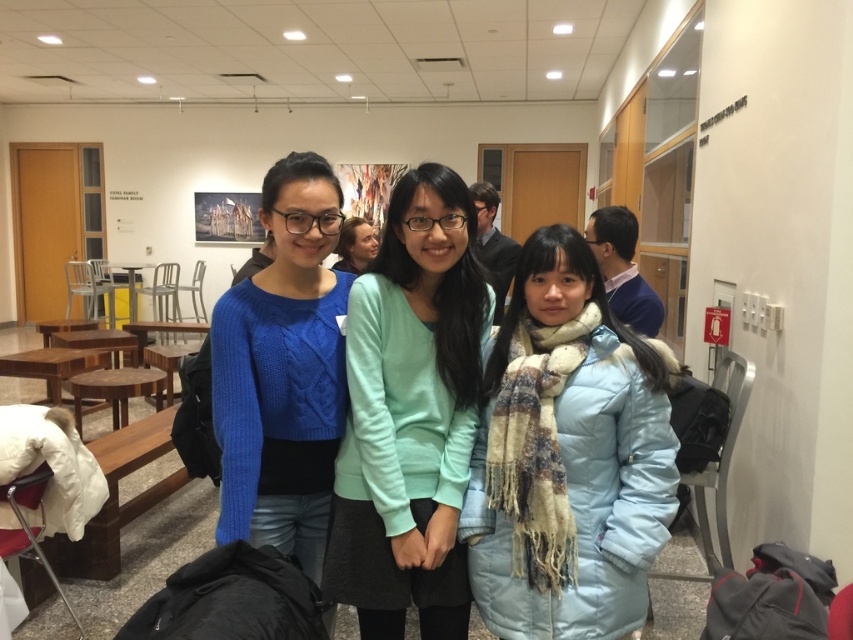
You are trying to locate the light blue down jacket at center in the image. Based on the coordinates provided, where would you find it in relation to the three individuals?

The light blue down jacket at center is located at coordinates point (x=567, y=458), which places it centrally among the three individuals in the image.

You are a photographer setting up a shoot in this scene. You notice the light blue down jacket at center and the mint green sweater at center. Which clothing item is positioned lower in the image?

The light blue down jacket at center is below the mint green sweater at center, so it is positioned lower in the image.

You are standing in a communal space with three people. You see a point at coordinates (567, 458). What object is located at that point?

The point at coordinates (567, 458) corresponds to the light blue down jacket at center.